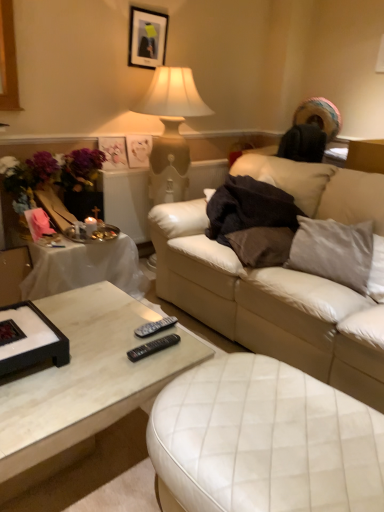
Find the location of `free space in front of matte white picture frame at upper center, the 2th picture frame when ordered from top to bottom`. free space in front of matte white picture frame at upper center, the 2th picture frame when ordered from top to bottom is located at coordinates (x=132, y=170).